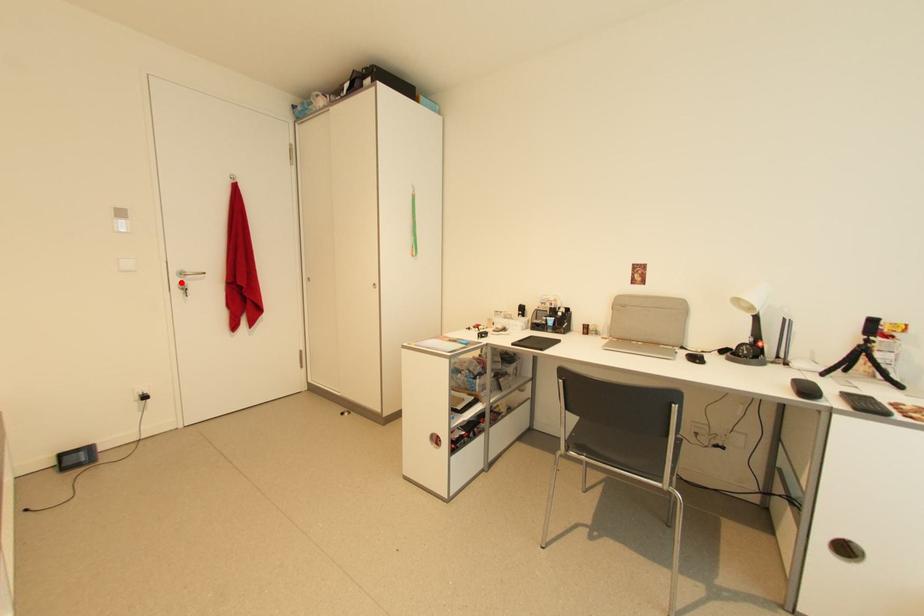
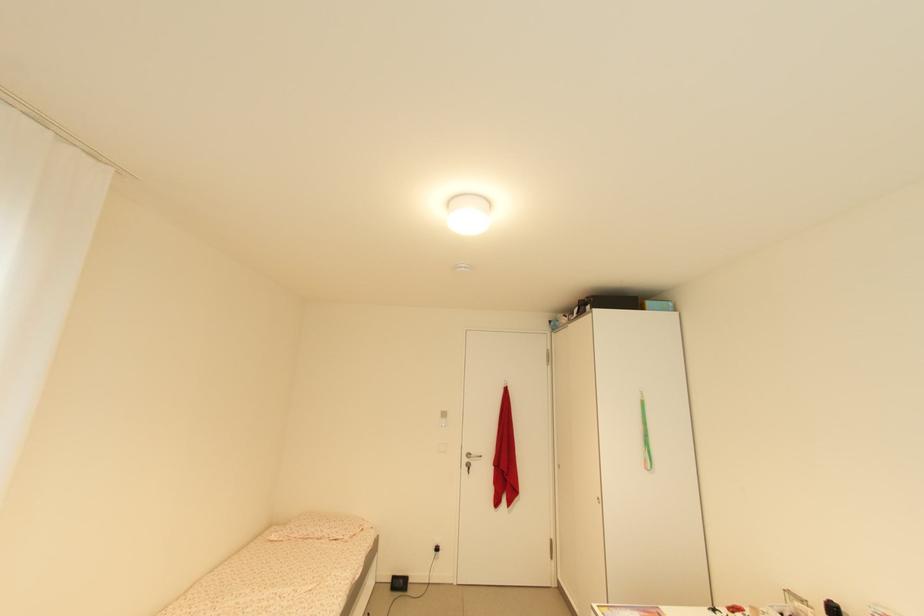
Find the pixel in the second image that matches the highlighted location in the first image.

(470, 461)